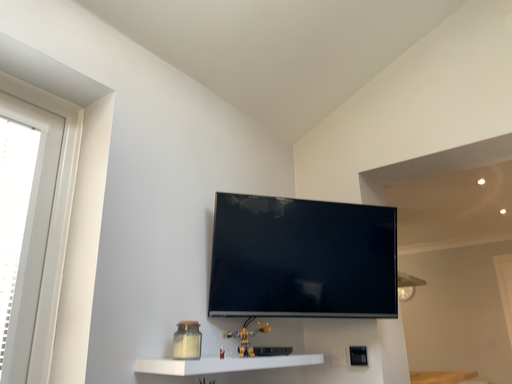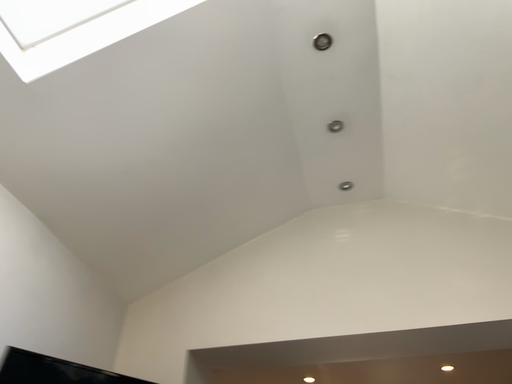
Question: How did the camera likely rotate when shooting the video?

Choices:
 (A) rotated left
 (B) rotated right

Answer: (B)